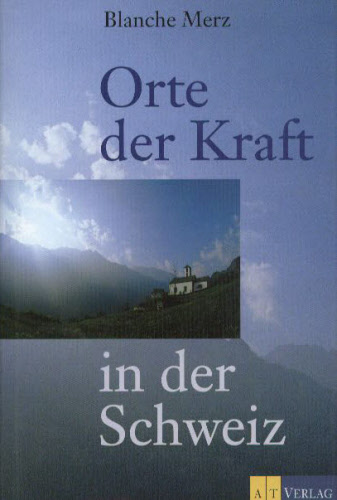
Find the location of `windows`. windows is located at coordinates [x=200, y=286], [x=186, y=287], [x=175, y=289].